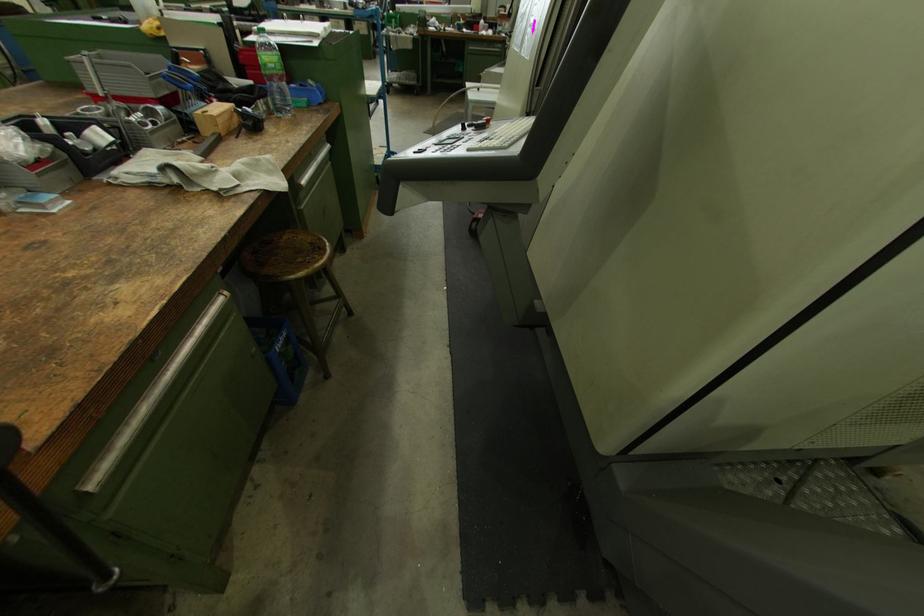
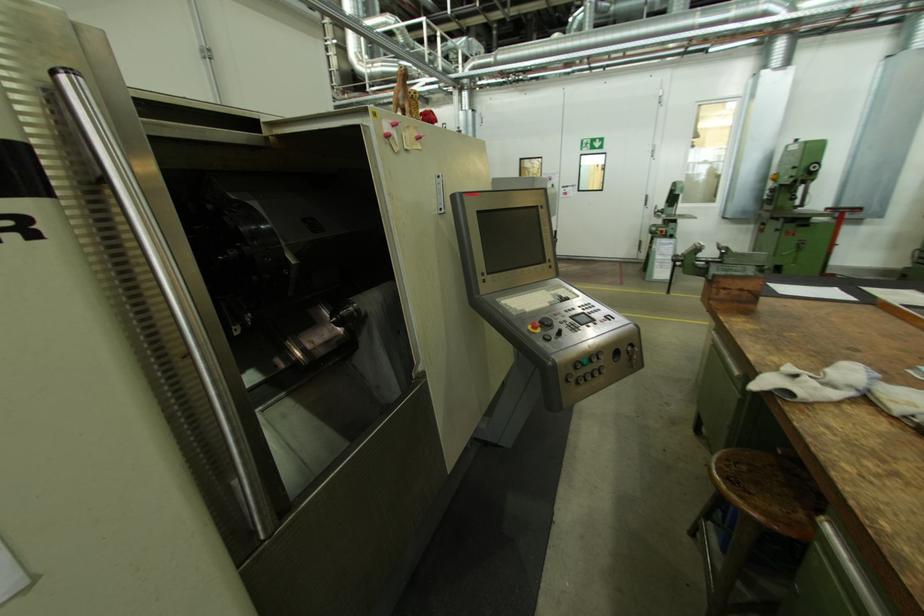
Find the pixel in the second image that matches [317,244] in the first image.

(755, 493)